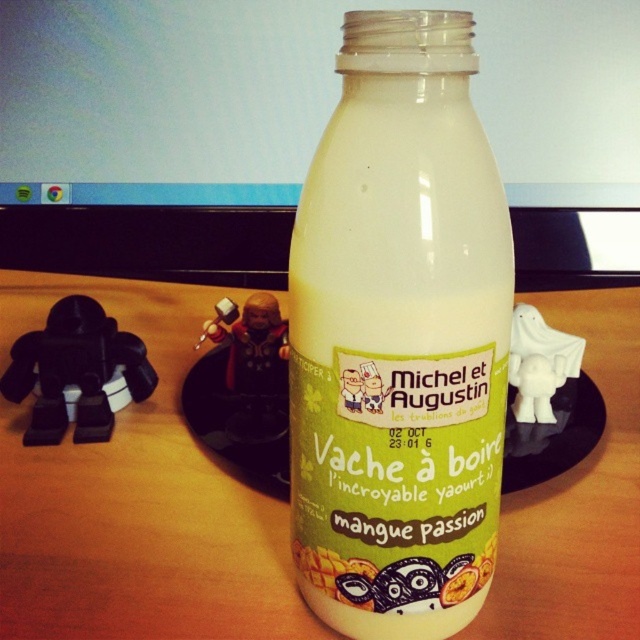
Does white matte bottle at center have a greater height compared to metallic figure at center?

Correct, white matte bottle at center is much taller as metallic figure at center.

Is white matte bottle at center smaller than metallic figure at center?

Actually, white matte bottle at center might be larger than metallic figure at center.

Describe the element at coordinates (400, 337) in the screenshot. I see `white matte bottle at center` at that location.

Image resolution: width=640 pixels, height=640 pixels. I want to click on white matte bottle at center, so click(x=400, y=337).

Can you confirm if black plastic toy at left is positioned below metallic figure at center?

Yes, black plastic toy at left is below metallic figure at center.

Is black plastic toy at left behind metallic figure at center?

Yes, black plastic toy at left is behind metallic figure at center.

Is point (102, 388) farther from camera compared to point (237, 387)?

Yes, point (102, 388) is farther from viewer.

Find the location of a particular element. The image size is (640, 640). black plastic toy at left is located at coordinates (76, 372).

Is white matte bottle at center to the left of black plastic toy at left from the viewer's perspective?

No, white matte bottle at center is not to the left of black plastic toy at left.

Is white matte bottle at center above black plastic toy at left?

Yes, white matte bottle at center is above black plastic toy at left.

Which is in front, point (348, 476) or point (116, 408)?

Point (348, 476) is in front.

Image resolution: width=640 pixels, height=640 pixels. Find the location of `white matte bottle at center`. white matte bottle at center is located at coordinates (400, 337).